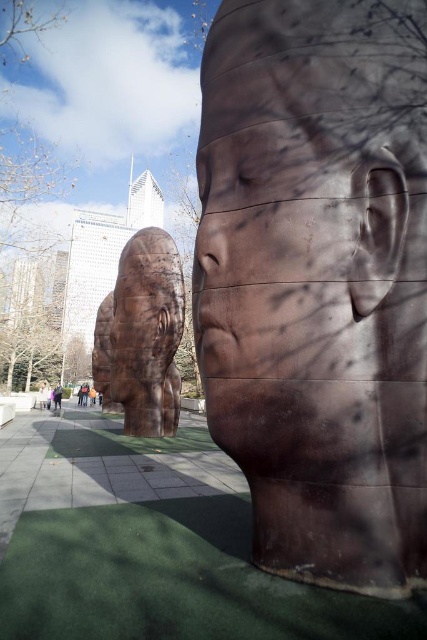
Does rusty metal face at center appear on the right side of rusty metal head at center?

Indeed, rusty metal face at center is positioned on the right side of rusty metal head at center.

Is point (397, 305) positioned in front of point (137, 304)?

Yes, it is in front of point (137, 304).

This screenshot has width=427, height=640. Find the location of `rusty metal face at center`. rusty metal face at center is located at coordinates [310, 218].